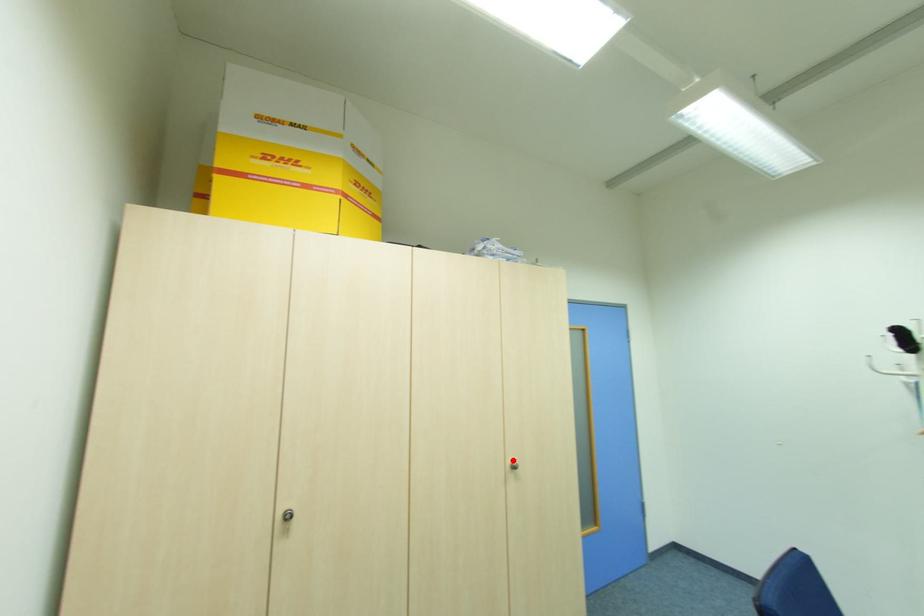
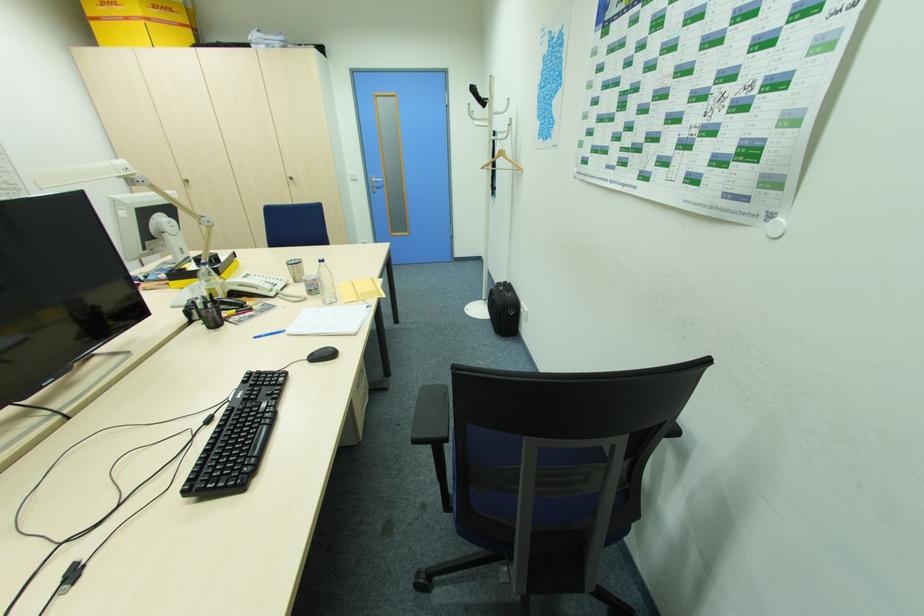
Where in the second image is the point corresponding to the highlighted location from the first image?

(292, 176)